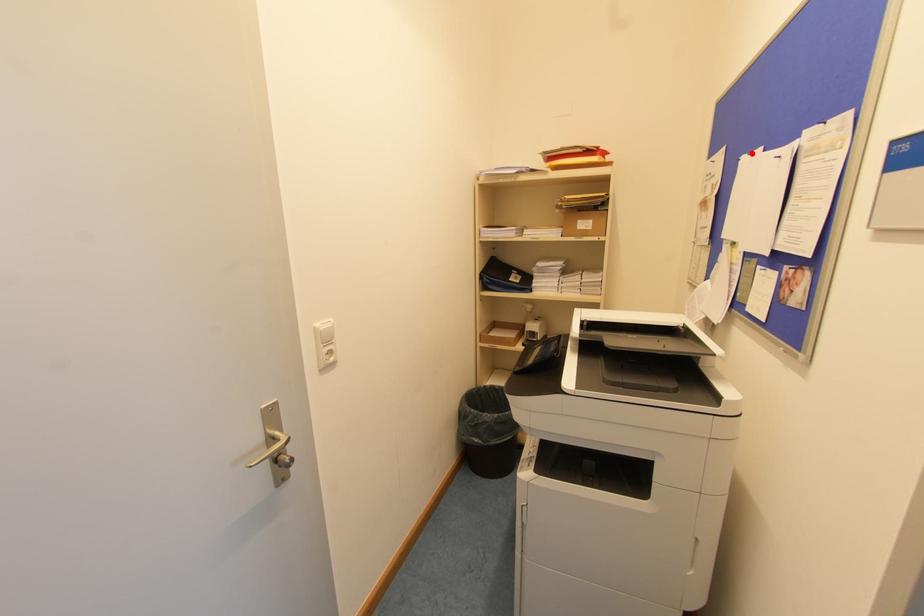
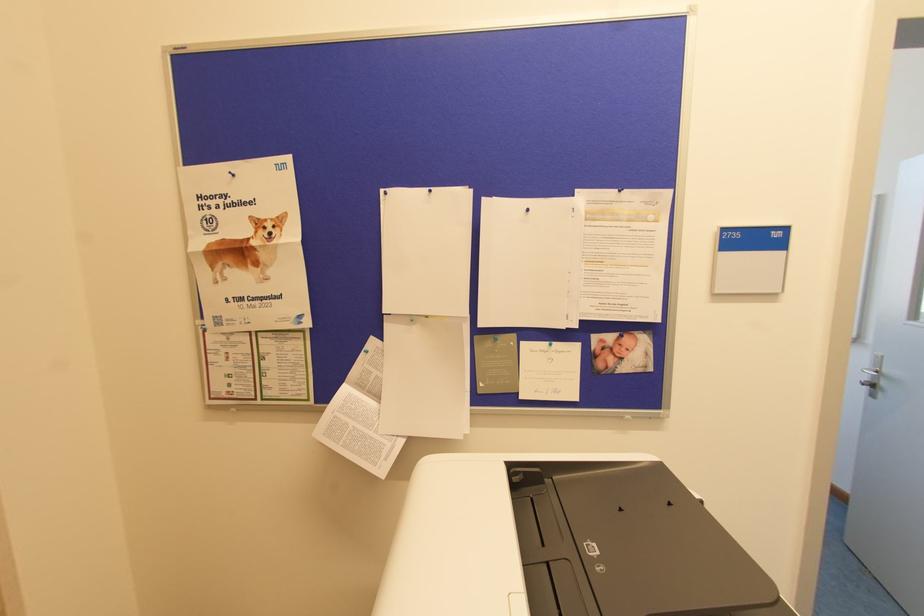
Locate, in the second image, the point that corresponds to the highlighted location in the first image.

(430, 191)